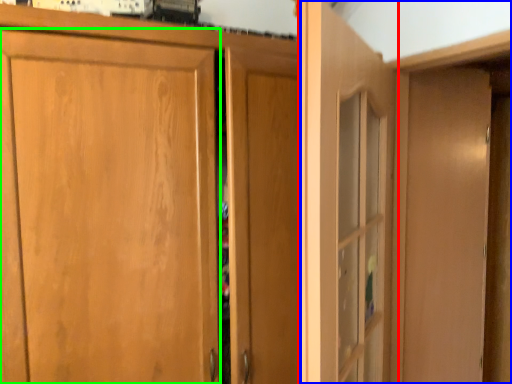
Question: Estimate the real-world distances between objects in this image. Which object is farther from door (highlighted by a red box), dresser (highlighted by a blue box) or door (highlighted by a green box)?

Choices:
 (A) dresser
 (B) door

Answer: (B)